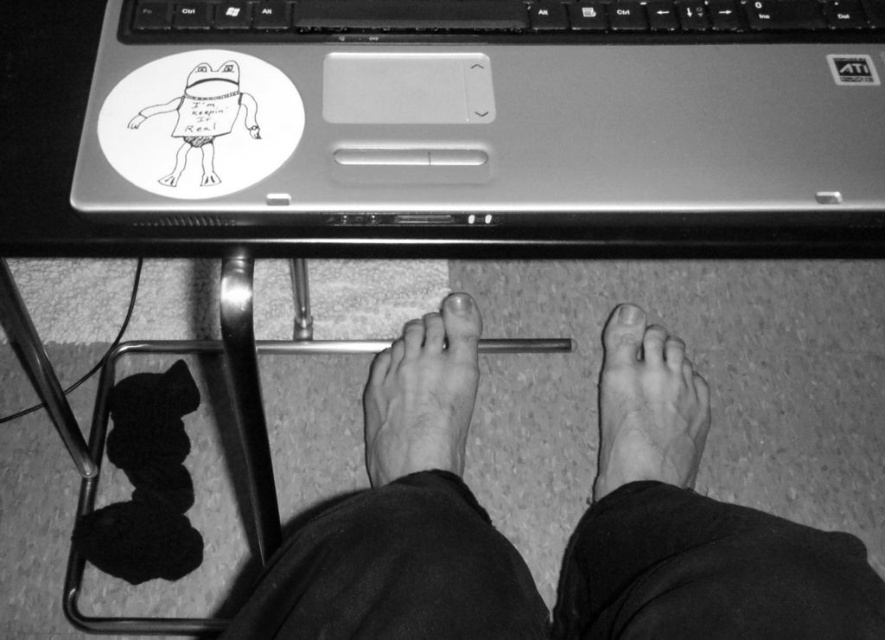
Question: Which object is farther from the camera taking this photo?

Choices:
 (A) dry skin foot at lower center
 (B) metallic silver sticker at upper right
 (C) black plastic keyboard at upper center
 (D) bare skin at center

Answer: (A)

Question: Which object appears closest to the camera in this image?

Choices:
 (A) black plastic keyboard at upper center
 (B) bare skin at center

Answer: (B)

Question: Is hairless skin foot at lower center closer to the viewer compared to metallic silver sticker at upper right?

Choices:
 (A) no
 (B) yes

Answer: (A)

Question: Is bare skin at center to the left of metallic silver sticker at upper right from the viewer's perspective?

Choices:
 (A) yes
 (B) no

Answer: (A)

Question: Does dry skin foot at lower center have a greater width compared to metallic silver sticker at upper right?

Choices:
 (A) yes
 (B) no

Answer: (A)

Question: Which object is positioned closest to the dry skin foot at lower center?

Choices:
 (A) hairless skin foot at lower center
 (B) metallic silver laptop at upper center
 (C) bare skin at center

Answer: (C)